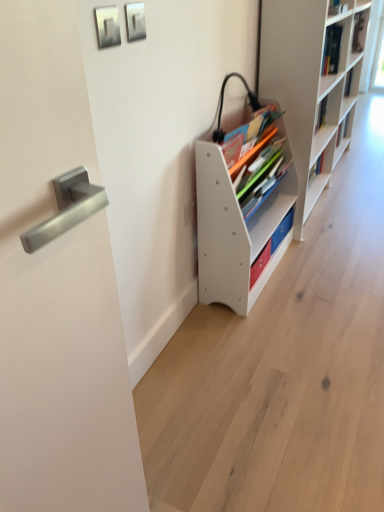
Question: Should I look upward or downward to see white plastic shelf at center, the 1th shelf viewed from the left?

Choices:
 (A) up
 (B) down

Answer: (A)

Question: Can you confirm if white plastic shelf at center, marked as the 2th shelf in a right-to-left arrangement, is positioned to the right of satin silver handle at left?

Choices:
 (A) no
 (B) yes

Answer: (B)

Question: From a real-world perspective, is white plastic shelf at center, marked as the 2th shelf in a right-to-left arrangement, positioned over satin silver handle at left based on gravity?

Choices:
 (A) no
 (B) yes

Answer: (A)

Question: Considering the relative sizes of white plastic shelf at center, marked as the 2th shelf in a right-to-left arrangement, and satin silver handle at left in the image provided, is white plastic shelf at center, marked as the 2th shelf in a right-to-left arrangement, thinner than satin silver handle at left?

Choices:
 (A) yes
 (B) no

Answer: (B)

Question: Considering the relative sizes of white plastic shelf at center, marked as the 2th shelf in a right-to-left arrangement, and satin silver handle at left in the image provided, is white plastic shelf at center, marked as the 2th shelf in a right-to-left arrangement, smaller than satin silver handle at left?

Choices:
 (A) yes
 (B) no

Answer: (B)

Question: Is white plastic shelf at center, marked as the 2th shelf in a right-to-left arrangement, at the left side of satin silver handle at left?

Choices:
 (A) yes
 (B) no

Answer: (B)

Question: Is white plastic shelf at center, marked as the 2th shelf in a right-to-left arrangement, bigger than satin silver handle at left?

Choices:
 (A) yes
 (B) no

Answer: (A)

Question: Can you see satin silver handle at left touching metallic silver picture frame at upper center, placed as the 2th picture frame when sorted from left to right?

Choices:
 (A) no
 (B) yes

Answer: (A)

Question: Is satin silver handle at left closer to camera compared to metallic silver picture frame at upper center, placed as the 2th picture frame when sorted from left to right?

Choices:
 (A) yes
 (B) no

Answer: (A)

Question: From the image's perspective, would you say satin silver handle at left is shown under metallic silver picture frame at upper center, placed as the 2th picture frame when sorted from left to right?

Choices:
 (A) no
 (B) yes

Answer: (B)

Question: Does satin silver handle at left have a smaller size compared to metallic silver picture frame at upper center, which is counted as the 1th picture frame, starting from the right?

Choices:
 (A) no
 (B) yes

Answer: (A)

Question: Can you confirm if satin silver handle at left is wider than metallic silver picture frame at upper center, placed as the 2th picture frame when sorted from left to right?

Choices:
 (A) no
 (B) yes

Answer: (B)

Question: Is satin silver handle at left oriented away from metallic silver picture frame at upper center, which is counted as the 1th picture frame, starting from the right?

Choices:
 (A) no
 (B) yes

Answer: (A)

Question: Is satin silver handle at left turned away from matte white bookshelf at center?

Choices:
 (A) no
 (B) yes

Answer: (A)